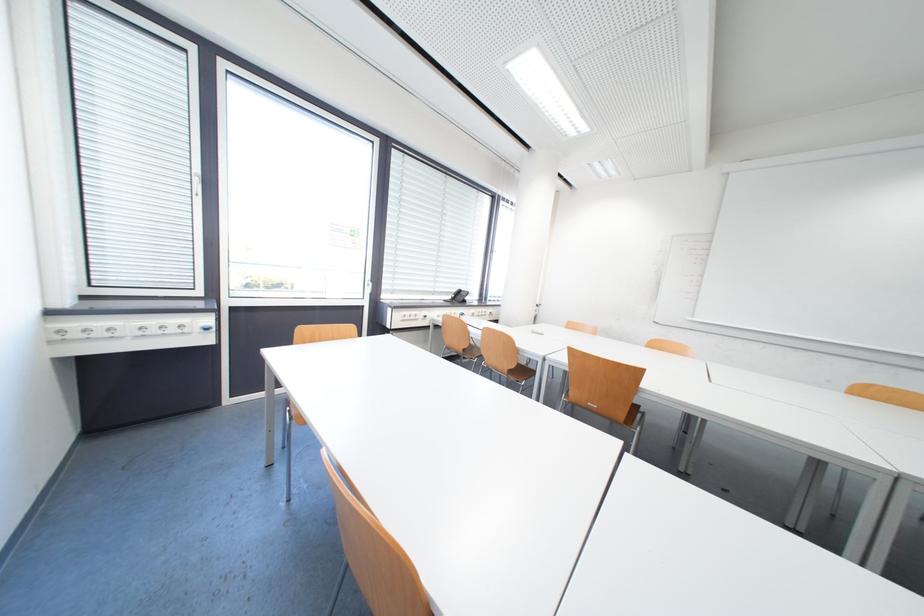
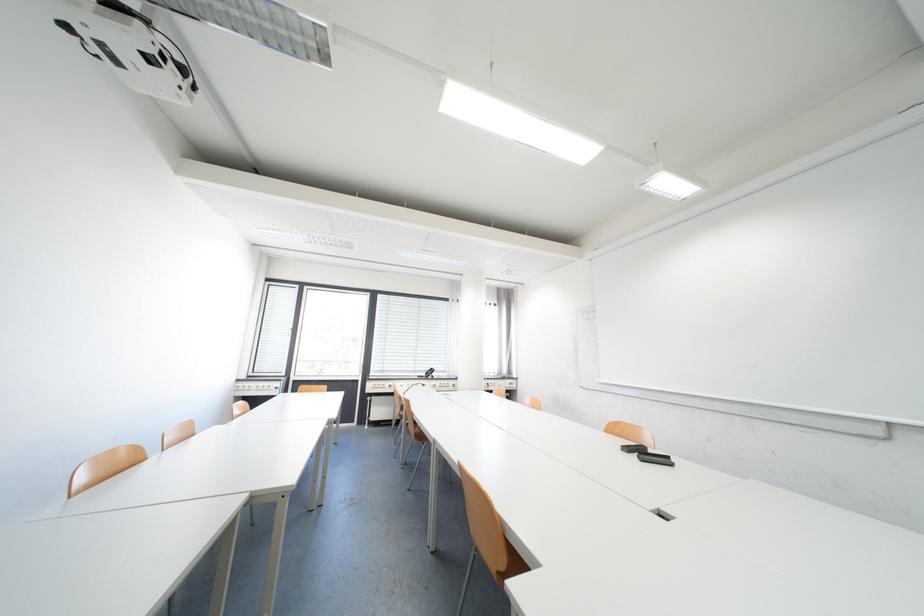
In the second image, find the point that corresponds to [444,294] in the first image.

(426, 371)